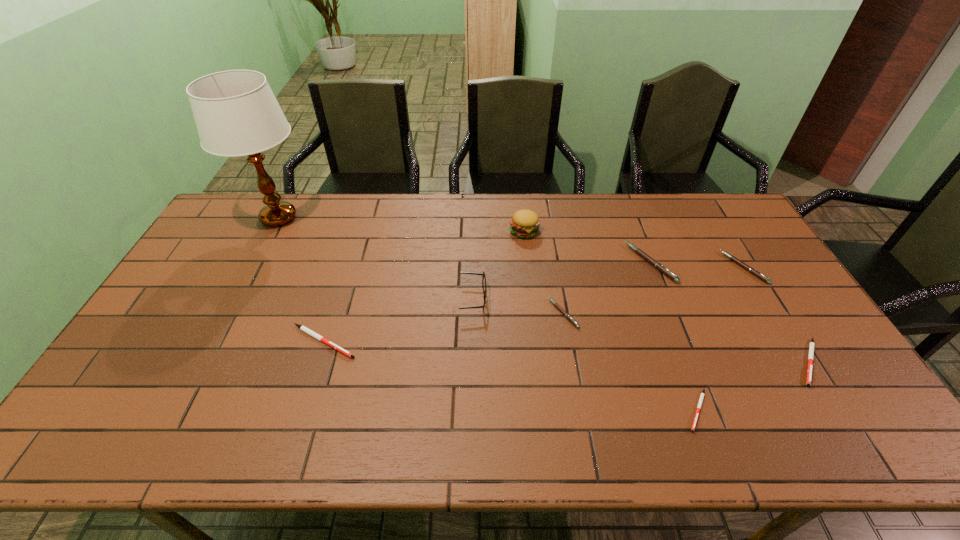
Where is `free spot located at the nib of the tallest pen`? free spot located at the nib of the tallest pen is located at coordinates (606, 263).

Where is `vacant region located 0.090m at the nib of the rightmost pink pen`? The width and height of the screenshot is (960, 540). vacant region located 0.090m at the nib of the rightmost pink pen is located at coordinates (700, 268).

Identify the location of free spot located at the nib of the rightmost pink pen. (612, 268).

Identify the location of vacant space situated 0.310m at the nib of the rightmost pink pen. The height and width of the screenshot is (540, 960). (632, 268).

This screenshot has height=540, width=960. What are the coordinates of `free space located 0.100m on the clicker of the second object from left to right` in the screenshot? It's located at (396, 341).

Locate an element on the screen. The height and width of the screenshot is (540, 960). vacant space located at the nib of the fifth pen from right to left is located at coordinates (512, 313).

The image size is (960, 540). I want to click on vacant position located 0.120m at the nib of the fifth pen from right to left, so click(x=509, y=313).

Locate an element on the screen. This screenshot has height=540, width=960. blank space located 0.380m at the nib of the fifth pen from right to left is located at coordinates (419, 313).

Locate an element on the screen. The height and width of the screenshot is (540, 960). vacant point located 0.090m on the clicker of the second biggest white pen is located at coordinates (847, 422).

Locate an element on the screen. The image size is (960, 540). table lamp that is at the far edge is located at coordinates (236, 113).